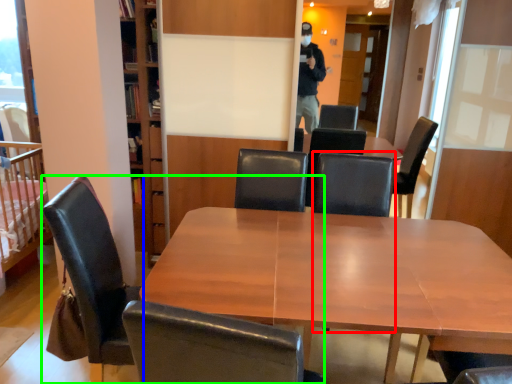
Question: Estimate the real-world distances between objects in this image. Which object is farther from armchair (highlighted by a red box), chair (highlighted by a blue box) or chair (highlighted by a green box)?

Choices:
 (A) chair
 (B) chair

Answer: (B)